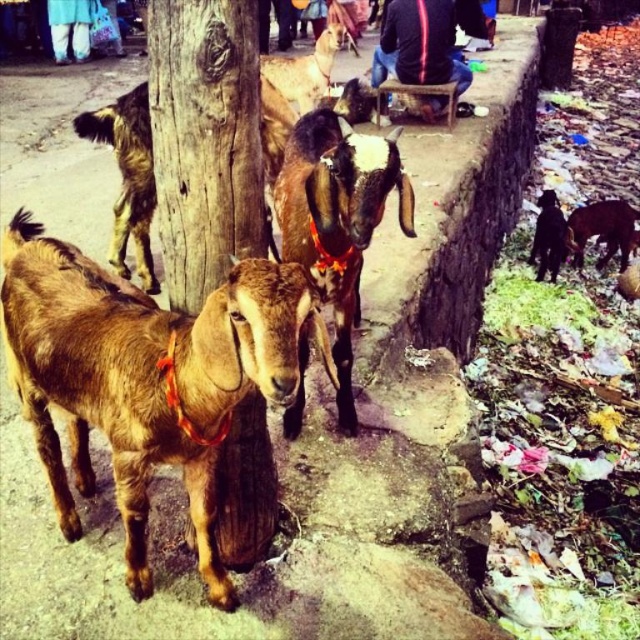
Question: Which of the following is the farthest from the observer?

Choices:
 (A) brown woolen goat at right
 (B) brown matte goat at center
 (C) brown woolen goat at upper center

Answer: (A)

Question: Which object is the closest to the brown matte goat at center?

Choices:
 (A) brown woolen goat at upper center
 (B) brown woolen goat at center
 (C) brown rough fur goat at left

Answer: (B)

Question: Is brown rough fur goat at right behind brown woolen goat at right?

Choices:
 (A) no
 (B) yes

Answer: (B)

Question: From the image, what is the correct spatial relationship of brown rough tree trunk at left in relation to brown woolen goat at right?

Choices:
 (A) left
 (B) right

Answer: (A)

Question: Among these objects, which one is nearest to the camera?

Choices:
 (A) brown matte goat at center
 (B) brown rough fur goat at left
 (C) brown woolen goat at center
 (D) brown woolen goat at right

Answer: (C)

Question: Does brown woolen goat at upper center appear on the left side of brown woolen goat at right?

Choices:
 (A) yes
 (B) no

Answer: (A)